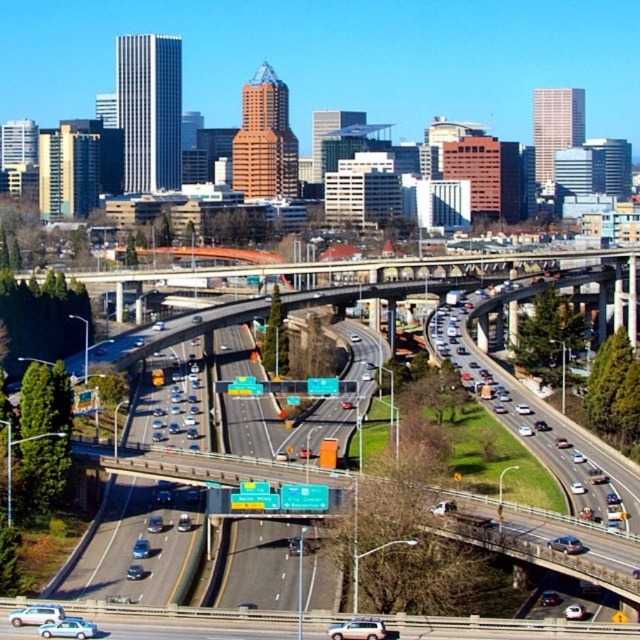
Question: Which of these objects is positioned farthest from the shiny blue sedan at lower right?

Choices:
 (A) white glossy sedan at center
 (B) pastel pink matte car at lower left
 (C) shiny silver sedan at lower left
 (D) silver metallic sedan at center

Answer: (B)

Question: Which object is farther from the camera taking this photo?

Choices:
 (A) shiny blue sedan at center
 (B) metallic blue sedan at center
 (C) shiny silver sedan at lower left
 (D) light blue metallic sedan at lower left

Answer: (B)

Question: Can you confirm if metallic silver suv at center is thinner than silver metallic sedan at center?

Choices:
 (A) yes
 (B) no

Answer: (B)

Question: Does shiny blue sedan at lower right have a lesser width compared to metallic blue sedan at center?

Choices:
 (A) yes
 (B) no

Answer: (A)

Question: Is the position of light blue metallic sedan at lower left less distant than that of shiny blue sedan at center?

Choices:
 (A) yes
 (B) no

Answer: (A)

Question: Which of the following is the closest to the observer?

Choices:
 (A) (582, 611)
 (B) (564, 550)
 (C) (138, 566)

Answer: (A)